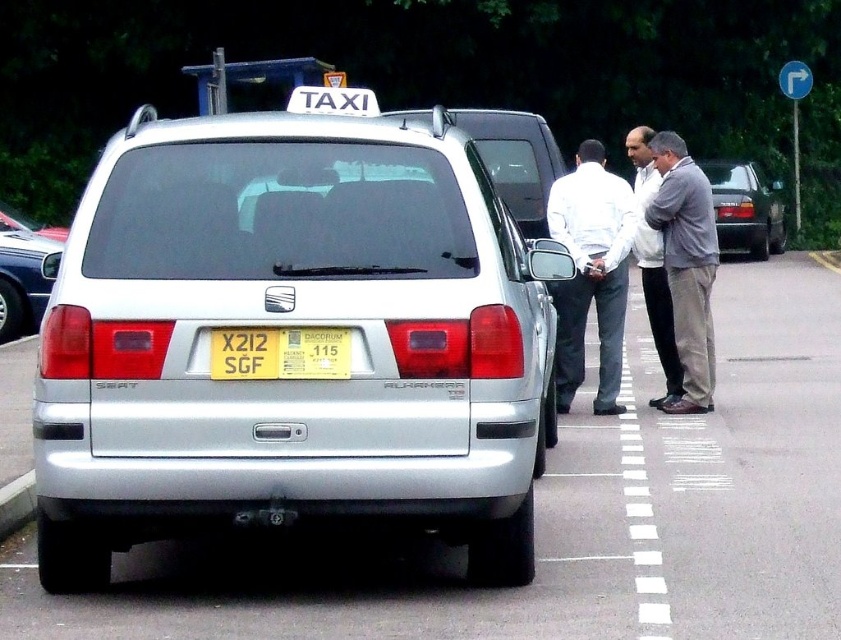
Measure the distance from white smooth shirt at center to gray suit at center.

The distance of white smooth shirt at center from gray suit at center is 24.45 inches.

Between white smooth shirt at center and gray suit at center, which one is positioned higher?

gray suit at center is higher up.

What do you see at coordinates (591, 272) in the screenshot? I see `white smooth shirt at center` at bounding box center [591, 272].

Find the location of `white smooth shirt at center`. white smooth shirt at center is located at coordinates (591, 272).

Does white smooth shirt at center appear on the right side of light gray shirt at center?

No, white smooth shirt at center is not to the right of light gray shirt at center.

Between white smooth shirt at center and light gray shirt at center, which one appears on the right side from the viewer's perspective?

Positioned to the right is light gray shirt at center.

Measure the distance between white smooth shirt at center and camera.

8.97 meters

This screenshot has width=841, height=640. What are the coordinates of `white smooth shirt at center` in the screenshot? It's located at (591, 272).

Is gray suit at center above yellow matte license plate at rear?

Yes.

The image size is (841, 640). Identify the location of gray suit at center. (686, 266).

At what (x,y) coordinates should I click in order to perform the action: click on gray suit at center. Please return your answer as a coordinate pair (x, y). Image resolution: width=841 pixels, height=640 pixels. Looking at the image, I should click on (686, 266).